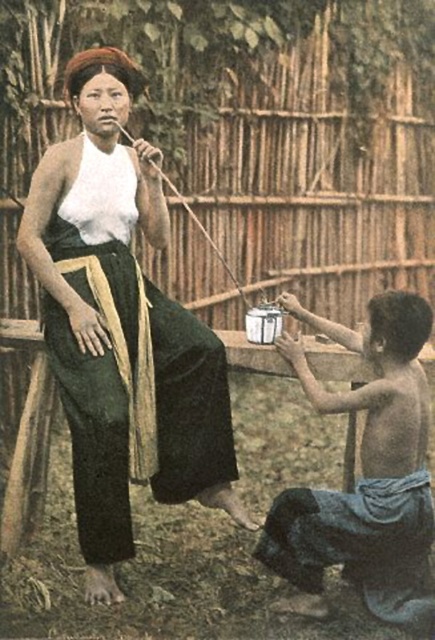
Question: Among these points, which one is farthest from the camera?

Choices:
 (A) (378, 605)
 (B) (106, 195)

Answer: (B)

Question: Where is matte white blouse at upper left located in relation to smooth wooden pot at lower right in the image?

Choices:
 (A) left
 (B) right

Answer: (A)

Question: Is matte white blouse at upper left smaller than smooth wooden pot at lower right?

Choices:
 (A) yes
 (B) no

Answer: (B)

Question: Which point appears closest to the camera in this image?

Choices:
 (A) (83, 342)
 (B) (341, 502)

Answer: (B)

Question: Which point is farther to the camera?

Choices:
 (A) (348, 337)
 (B) (159, 308)

Answer: (B)

Question: Does matte white blouse at upper left lie behind smooth wooden pot at lower right?

Choices:
 (A) yes
 (B) no

Answer: (A)